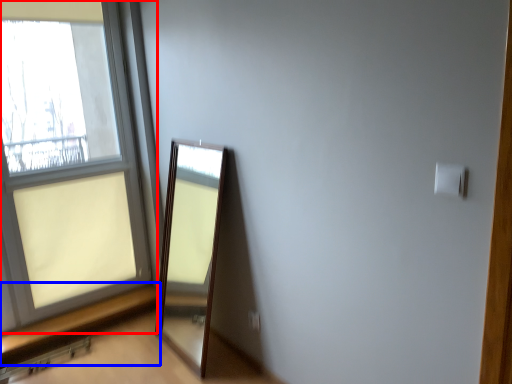
Question: Among these objects, which one is farthest to the camera, window (highlighted by a red box) or window sill (highlighted by a blue box)?

Choices:
 (A) window
 (B) window sill

Answer: (B)